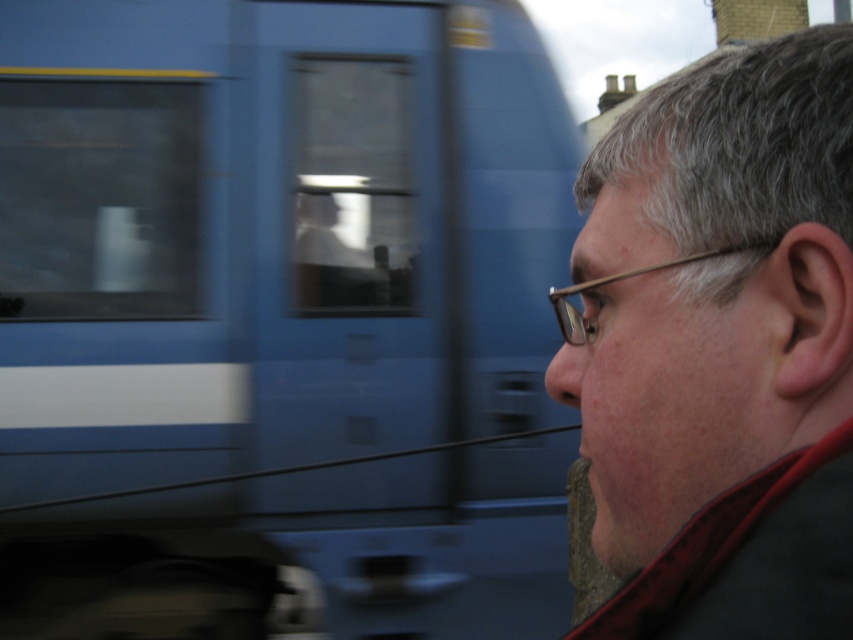
Describe the element at coordinates (720, 346) in the screenshot. I see `matte black jacket at right` at that location.

Is point (821, 108) positioned in front of point (590, 326)?

Yes, point (821, 108) is closer to viewer.

Locate an element on the screen. matte black jacket at right is located at coordinates (720, 346).

Which is above, blue glossy train at upper left or matte black jacket at right?

Positioned higher is matte black jacket at right.

Can you confirm if blue glossy train at upper left is bigger than matte black jacket at right?

Correct, blue glossy train at upper left is larger in size than matte black jacket at right.

Is point (471, 150) more distant than point (785, 214)?

Yes, it is.

Find the location of a particular element. Image resolution: width=853 pixels, height=640 pixels. blue glossy train at upper left is located at coordinates (280, 320).

Is blue glossy train at upper left positioned before gold metallic glasses at right?

No, blue glossy train at upper left is behind gold metallic glasses at right.

Does blue glossy train at upper left appear on the right side of gold metallic glasses at right?

No, blue glossy train at upper left is not to the right of gold metallic glasses at right.

Who is more forward, (451, 324) or (606, 275)?

Point (606, 275) is in front.

This screenshot has width=853, height=640. I want to click on blue glossy train at upper left, so click(280, 320).